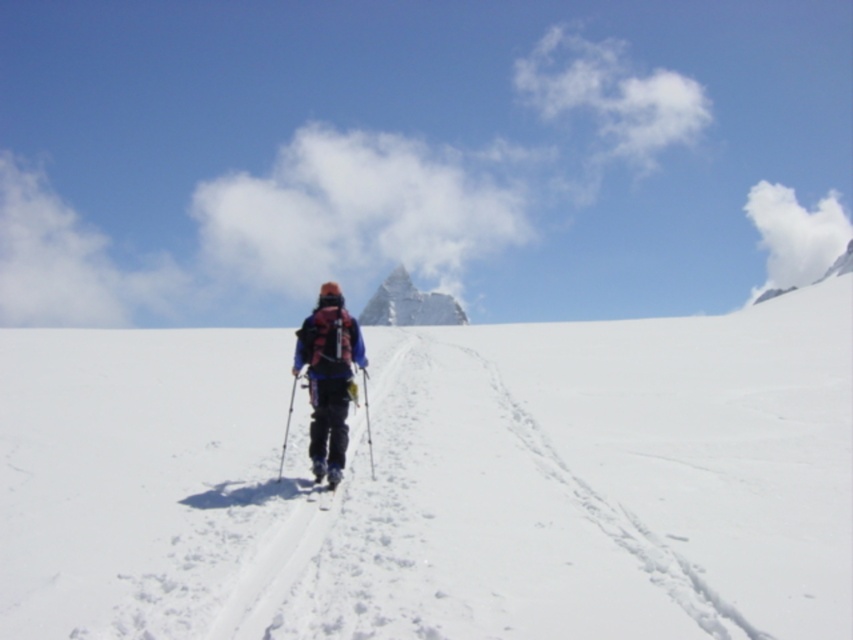
Question: Is white fluffy cloud at upper center to the right of matte black ski pole at center from the viewer's perspective?

Choices:
 (A) yes
 (B) no

Answer: (B)

Question: Based on their relative distances, which object is farther from the matte black ski pole at center?

Choices:
 (A) matte pink backpack at center
 (B) black matte ski at center

Answer: (A)

Question: Which point is closer to the camera?

Choices:
 (A) matte black ski pole at center
 (B) white snow-covered peak at center
 (C) white fluffy cloud at upper right

Answer: (A)

Question: Which object appears closest to the camera in this image?

Choices:
 (A) white powdery snow at center
 (B) black matte ski at center
 (C) white matte ski at center

Answer: (A)

Question: Does black matte ski at center have a greater width compared to white matte ski at center?

Choices:
 (A) no
 (B) yes

Answer: (B)

Question: Does black matte ski at center have a lesser width compared to white matte ski at center?

Choices:
 (A) yes
 (B) no

Answer: (B)